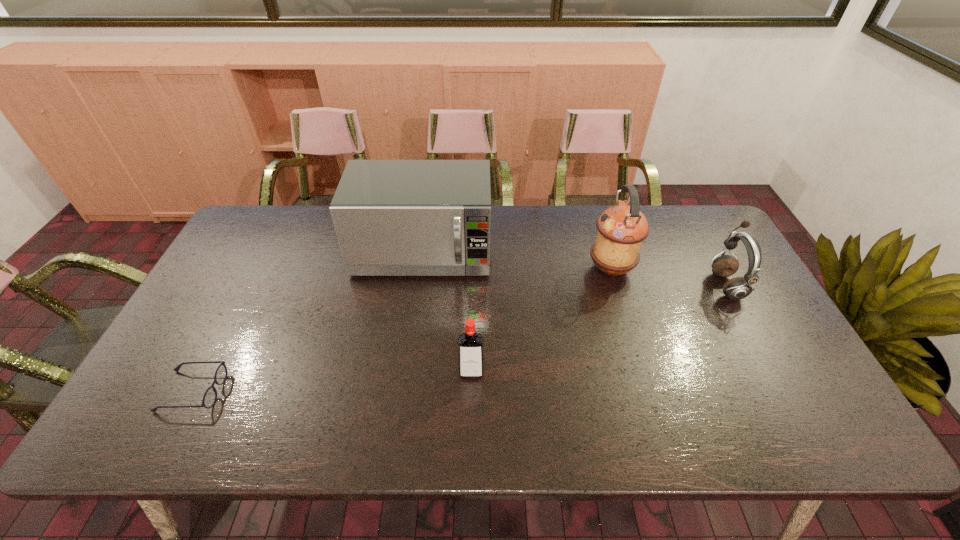
Identify the location of vacant region located on the ear pads of the earphone. This screenshot has height=540, width=960. (578, 285).

The width and height of the screenshot is (960, 540). Find the location of `vacant position located on the front and back of the vodka`. vacant position located on the front and back of the vodka is located at coordinates (470, 409).

What are the coordinates of `vacant space located 0.140m on the front-facing side of the spectacles` in the screenshot? It's located at (279, 392).

Locate an element on the screen. object at the far edge is located at coordinates (392, 217).

Image resolution: width=960 pixels, height=540 pixels. What are the coordinates of `object located at the near edge` in the screenshot? It's located at pos(209,399).

Find the location of `object positioned at the left edge`. object positioned at the left edge is located at coordinates (209, 399).

The height and width of the screenshot is (540, 960). Find the location of `object present at the right edge`. object present at the right edge is located at coordinates (737, 288).

Locate an element on the screen. The image size is (960, 540). object present at the near left corner is located at coordinates (209, 399).

Image resolution: width=960 pixels, height=540 pixels. I want to click on vacant region at the far edge of the desktop, so click(315, 208).

Where is `vacant space at the near edge`? The height and width of the screenshot is (540, 960). vacant space at the near edge is located at coordinates (378, 422).